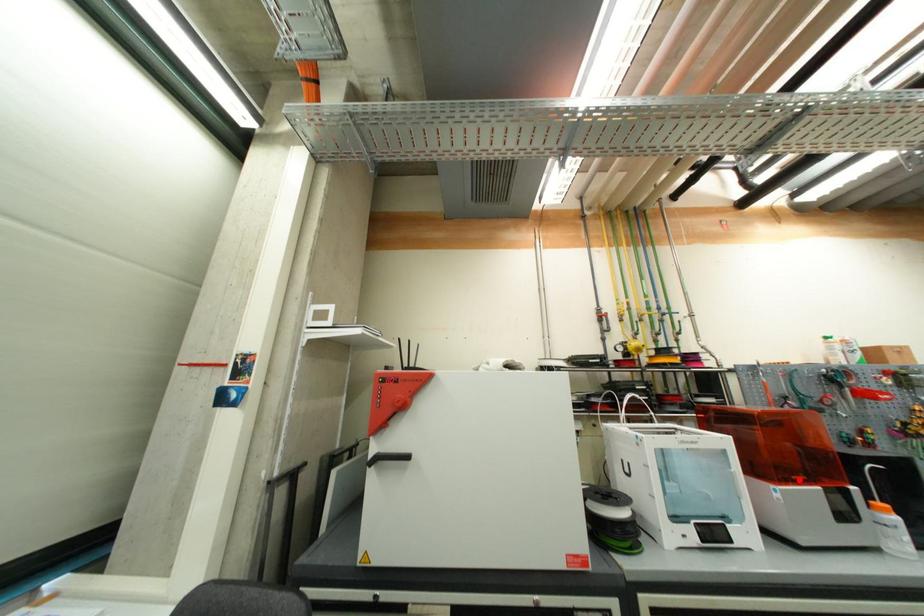
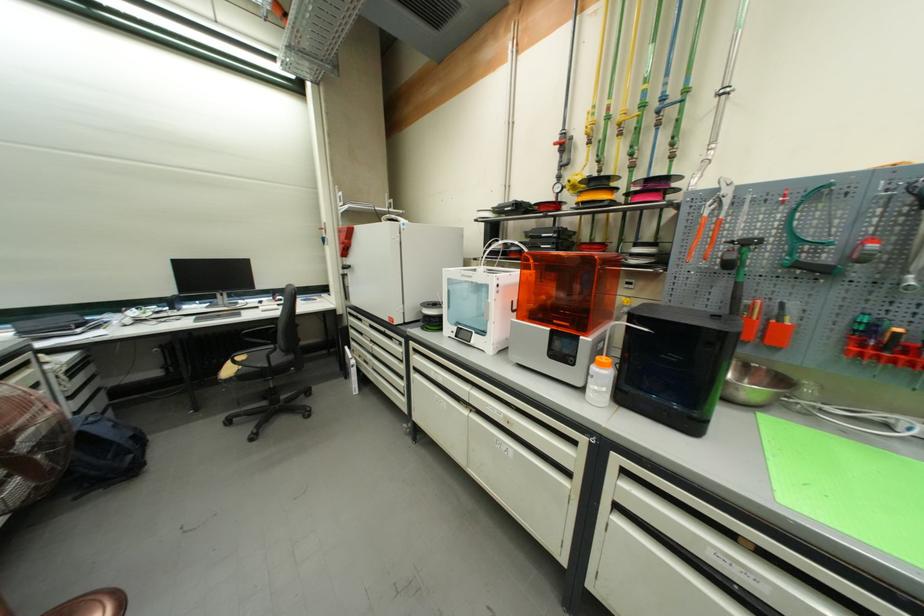
The point at the highlighted location is marked in the first image. Where is the corresponding point in the second image?

(561, 323)